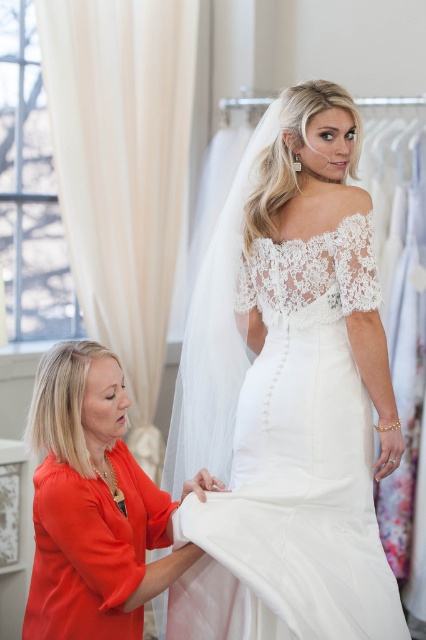
Does white satin dress at center have a greater width compared to matte orange blouse at lower left?

Yes, white satin dress at center is wider than matte orange blouse at lower left.

Can you confirm if white satin dress at center is shorter than matte orange blouse at lower left?

In fact, white satin dress at center may be taller than matte orange blouse at lower left.

Who is more forward, (232, 500) or (80, 634)?

Positioned in front is point (80, 634).

The height and width of the screenshot is (640, 426). In order to click on white satin dress at center in this screenshot , I will do `click(287, 396)`.